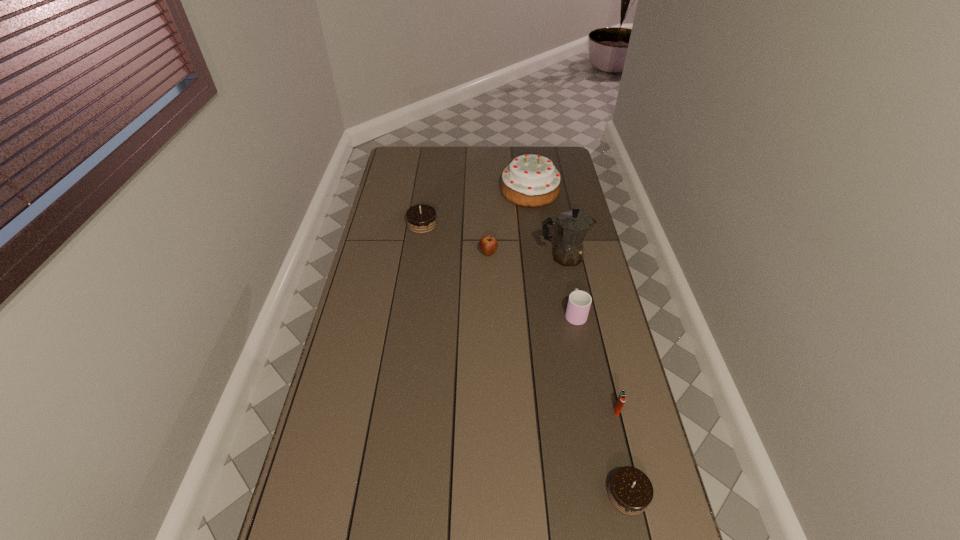
Find the location of a particular element. The height and width of the screenshot is (540, 960). vacant space located on the right of the second farthest object is located at coordinates (508, 225).

The width and height of the screenshot is (960, 540). I want to click on free location located 0.330m on the back of the nearer chocolate cake, so click(599, 366).

Locate an element on the screen. The width and height of the screenshot is (960, 540). vacant space located 0.280m on the front of the farthest object is located at coordinates (538, 251).

You are a GUI agent. You are given a task and a screenshot of the screen. Output one action in this format:
    pyautogui.click(x=<x>, y=<y>)
    Task: Click on the vacant region located with the handle on the side of the third nearest object
    The width and height of the screenshot is (960, 540).
    Given the screenshot: What is the action you would take?
    pyautogui.click(x=562, y=242)

You are a GUI agent. You are given a task and a screenshot of the screen. Output one action in this format:
    pyautogui.click(x=<x>, y=<y>)
    Task: Click on the free space located 0.390m with the handle on the side of the third nearest object
    This screenshot has width=960, height=540.
    Given the screenshot: What is the action you would take?
    559,232

Image resolution: width=960 pixels, height=540 pixels. I want to click on vacant space situated with the handle on the side of the third nearest object, so click(562, 244).

Locate an element on the screen. This screenshot has height=540, width=960. free space located on the front of the apple is located at coordinates (490, 302).

Find the location of a particular element. The width and height of the screenshot is (960, 540). vacant space located on the front of the igniter is located at coordinates (643, 519).

Locate an element on the screen. The image size is (960, 540). object that is positioned at the near edge is located at coordinates (630, 491).

This screenshot has height=540, width=960. Find the location of `object at the left edge`. object at the left edge is located at coordinates (421, 219).